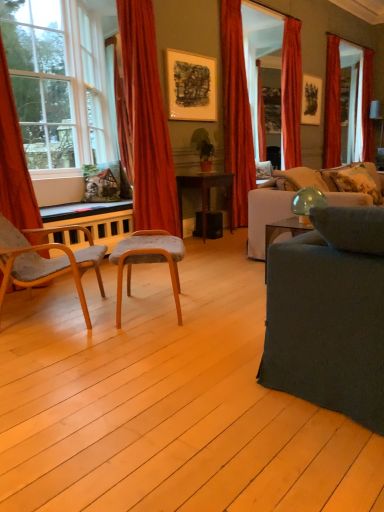
Image resolution: width=384 pixels, height=512 pixels. Identify the location of vacant space behind gray fabric stool at center, which appears as the 1th chair when viewed from the right. (159, 286).